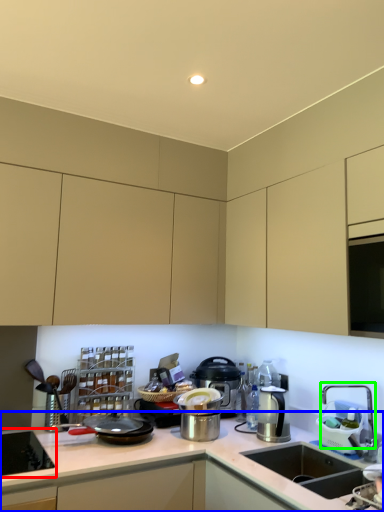
Question: Based on their relative distances, which object is nearer to home appliance (highlighted by a red box)? Choose from countertop (highlighted by a blue box) and faucet (highlighted by a green box).

Choices:
 (A) countertop
 (B) faucet

Answer: (A)